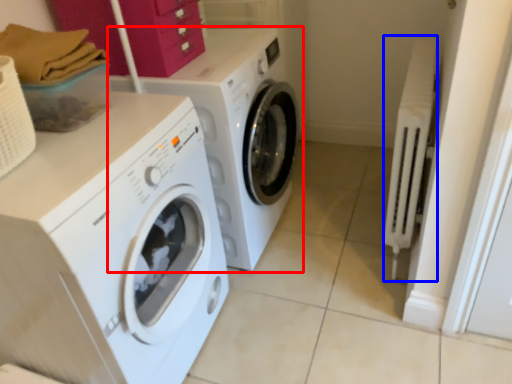
Question: Which point is closer to the camera, washing machine (highlighted by a red box) or radiator (highlighted by a blue box)?

Choices:
 (A) washing machine
 (B) radiator

Answer: (B)